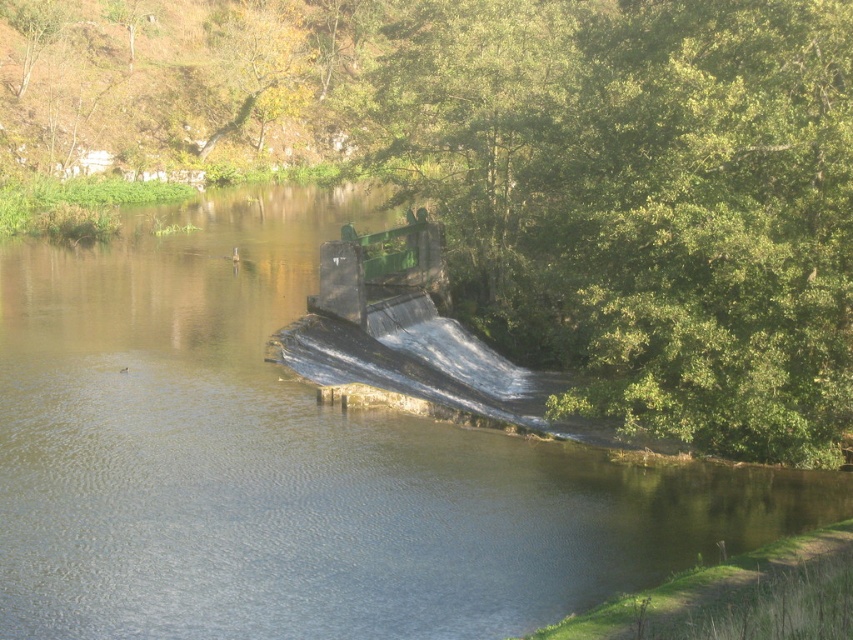
The height and width of the screenshot is (640, 853). What do you see at coordinates (519, 188) in the screenshot?
I see `green leafy tree at center` at bounding box center [519, 188].

Does point (440, 189) lie in front of point (160, 532)?

No, (440, 189) is further to viewer.

This screenshot has height=640, width=853. What do you see at coordinates (519, 188) in the screenshot?
I see `green leafy tree at center` at bounding box center [519, 188].

The width and height of the screenshot is (853, 640). I want to click on green leafy tree at center, so click(x=519, y=188).